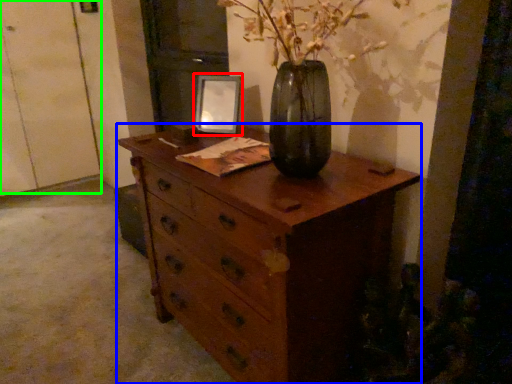
Question: Which object is the farthest from picture frame (highlighted by a red box)? Choose among these: chest of drawers (highlighted by a blue box) or door (highlighted by a green box).

Choices:
 (A) chest of drawers
 (B) door

Answer: (B)